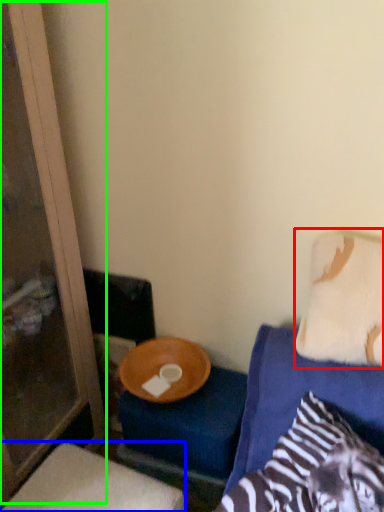
Question: Considering the real-world distances, which object is closest to pillow (highlighted by a red box)? furniture (highlighted by a blue box) or screen door (highlighted by a green box).

Choices:
 (A) furniture
 (B) screen door

Answer: (A)